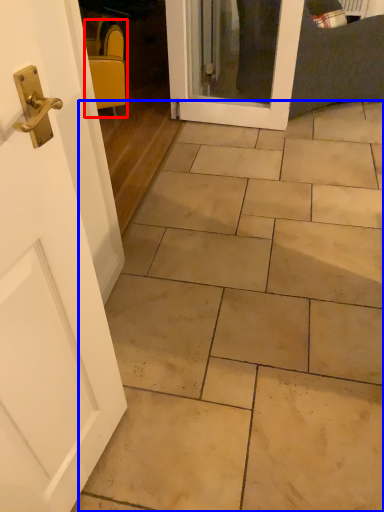
Question: Which of the following is the closest to the observer, chair (highlighted by a red box) or ceramic tile (highlighted by a blue box)?

Choices:
 (A) chair
 (B) ceramic tile

Answer: (B)